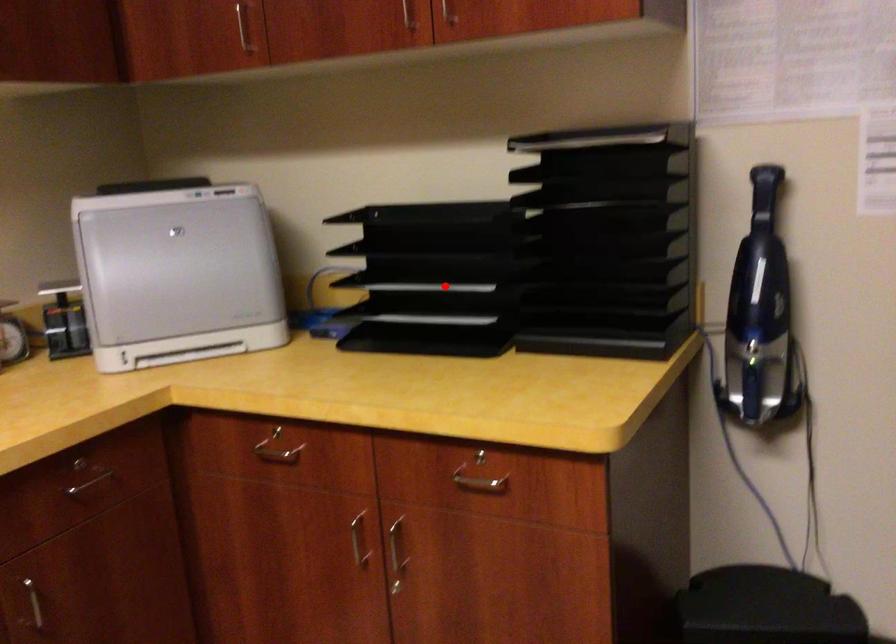
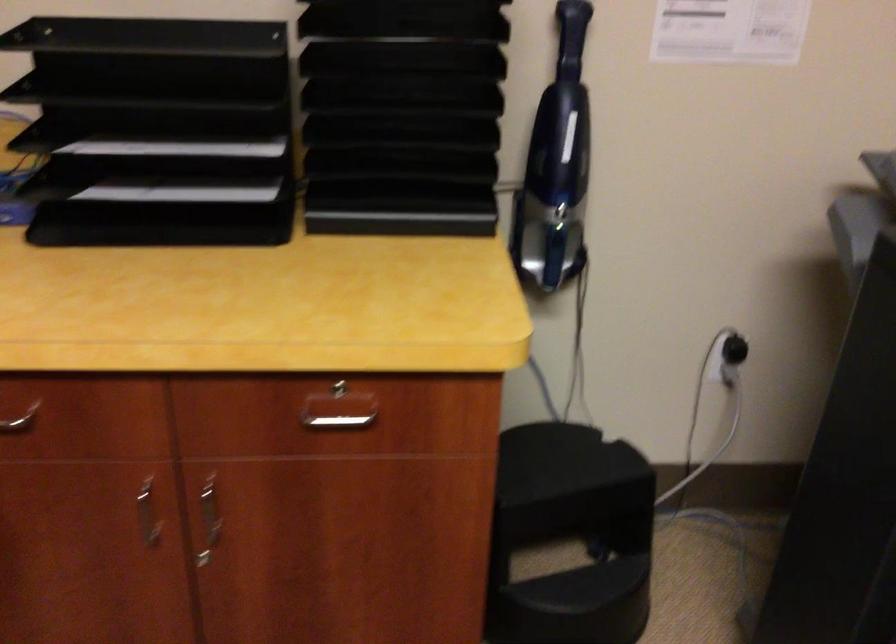
Question: I am providing you with two images of the same scene from different viewpoints. A red point is shown in image1. For the corresponding object point in image2, is it positioned nearer or farther from the camera?

Choices:
 (A) Nearer
 (B) Farther

Answer: (A)